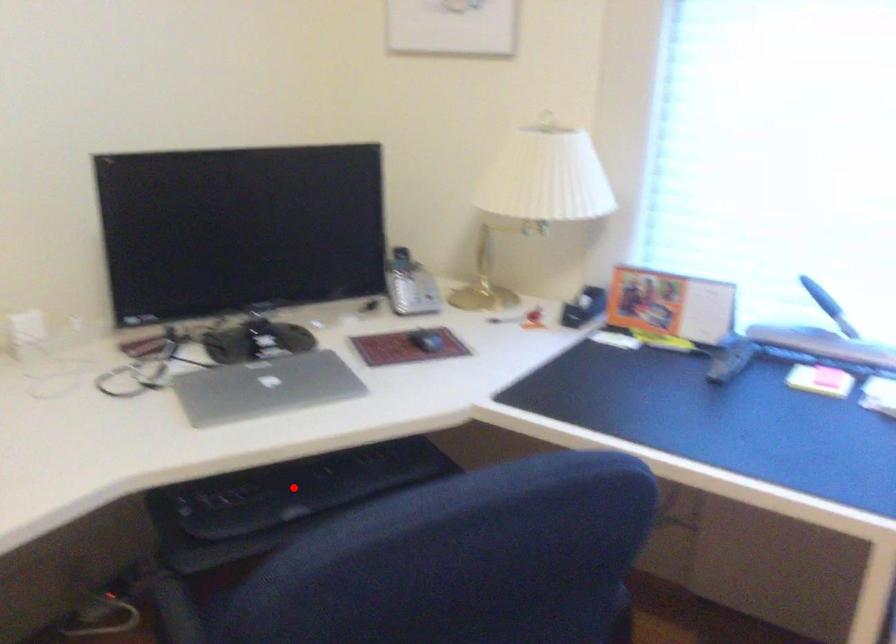
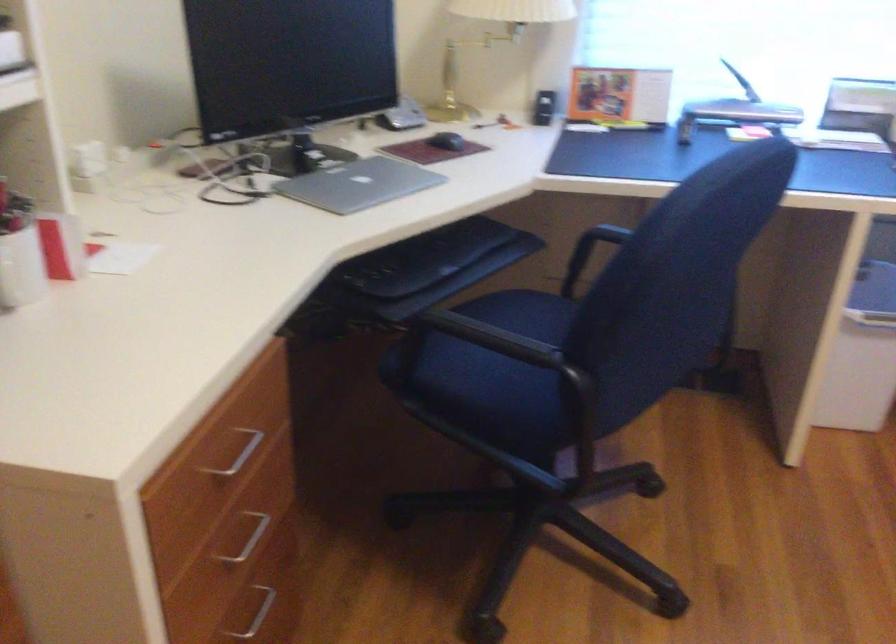
Question: I am providing you with two images of the same scene from different viewpoints. A red point is shown in image1. For the corresponding object point in image2, is it positioned nearer or farther from the camera?

Choices:
 (A) Nearer
 (B) Farther

Answer: (B)